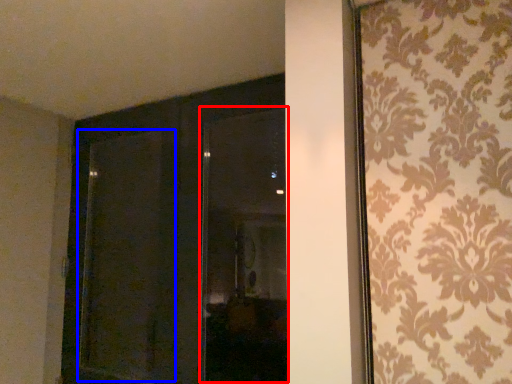
Question: Which object appears farthest to the camera in this image, window (highlighted by a red box) or screen door (highlighted by a blue box)?

Choices:
 (A) window
 (B) screen door

Answer: (B)